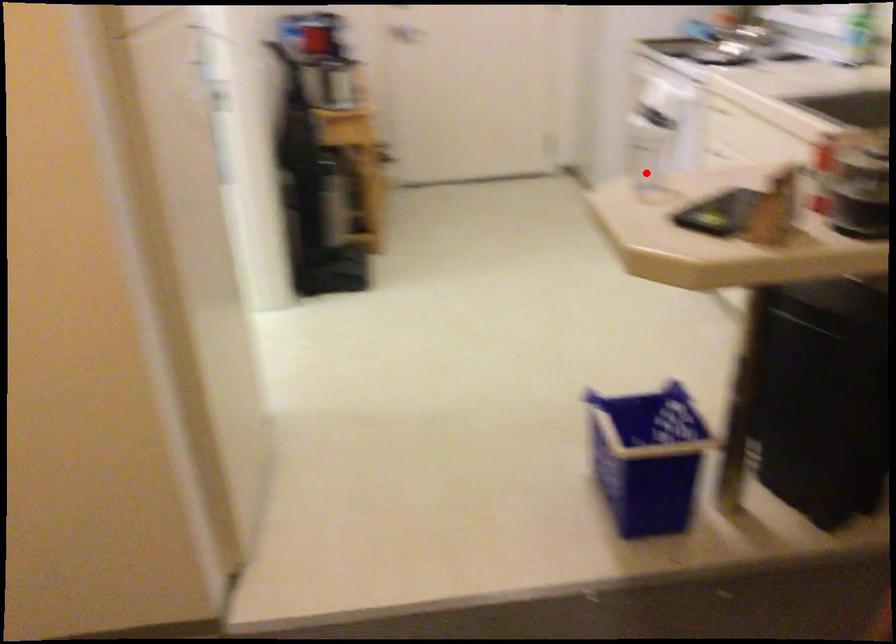
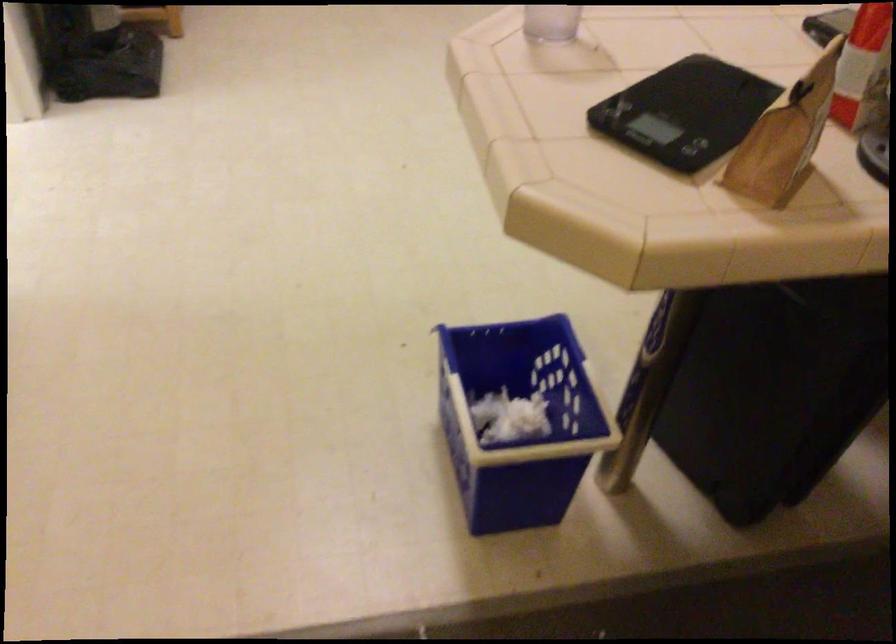
Question: I am providing you with two images of the same scene from different viewpoints. Given a red point in image1, look at the same physical point in image2. Is it:

Choices:
 (A) Closer to the viewpoint
 (B) Farther from the viewpoint

Answer: (A)